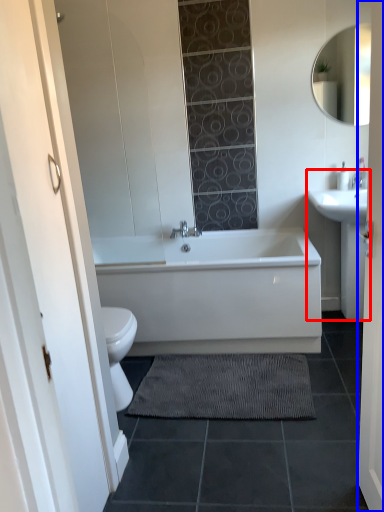
Question: Among these objects, which one is farthest to the camera, sink (highlighted by a red box) or door (highlighted by a blue box)?

Choices:
 (A) sink
 (B) door

Answer: (A)